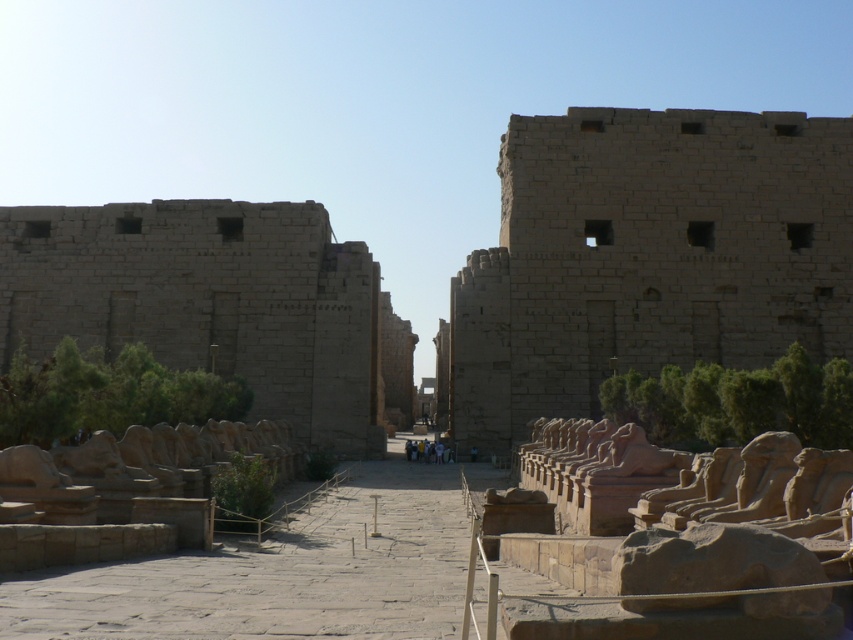
Does brown stone wall at center appear on the left side of beige stone ruins at left?

In fact, brown stone wall at center is to the right of beige stone ruins at left.

Can you confirm if brown stone wall at center is smaller than beige stone ruins at left?

Indeed, brown stone wall at center has a smaller size compared to beige stone ruins at left.

Which is behind, point (700, 129) or point (77, 250)?

The point (77, 250) is more distant.

Find the location of a particular element. The height and width of the screenshot is (640, 853). brown stone wall at center is located at coordinates (647, 257).